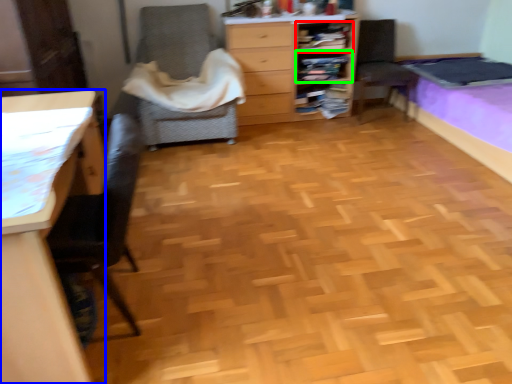
Question: Which object is positioned farthest from shelf (highlighted by a red box)? Select from desk (highlighted by a blue box) and shelf (highlighted by a green box).

Choices:
 (A) desk
 (B) shelf

Answer: (A)